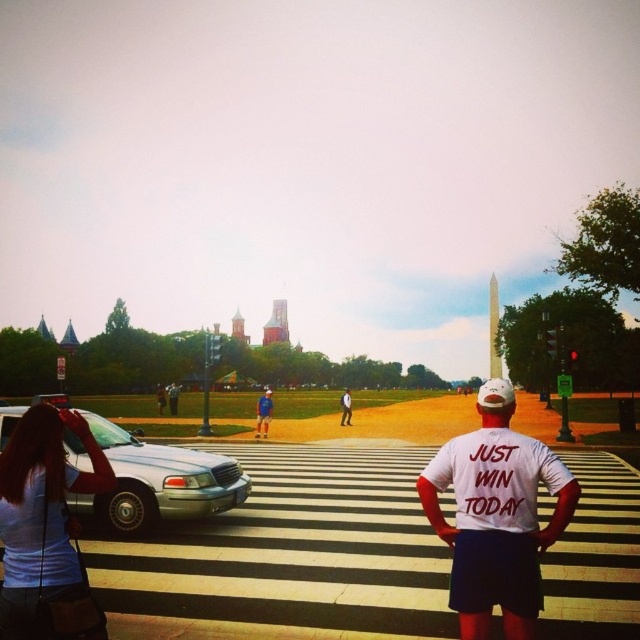
Is white matte shirt at center further to camera compared to light blue t-shirt at center-left?

That is True.

Identify the location of white matte shirt at center. (497, 515).

This screenshot has height=640, width=640. I want to click on white matte shirt at center, so click(x=497, y=515).

Between point (40, 412) and point (264, 420), which one is positioned in front?

Point (40, 412) is more forward.

Which is behind, point (52, 451) or point (269, 417)?

The point (269, 417) is more distant.

The height and width of the screenshot is (640, 640). Find the location of `light blue t-shirt at center-left`. light blue t-shirt at center-left is located at coordinates (42, 513).

What do you see at coordinates (346, 406) in the screenshot? The width and height of the screenshot is (640, 640). I see `white cotton shirt at center` at bounding box center [346, 406].

Image resolution: width=640 pixels, height=640 pixels. What do you see at coordinates (346, 406) in the screenshot? I see `white cotton shirt at center` at bounding box center [346, 406].

Locate an element on the screen. white cotton shirt at center is located at coordinates (346, 406).